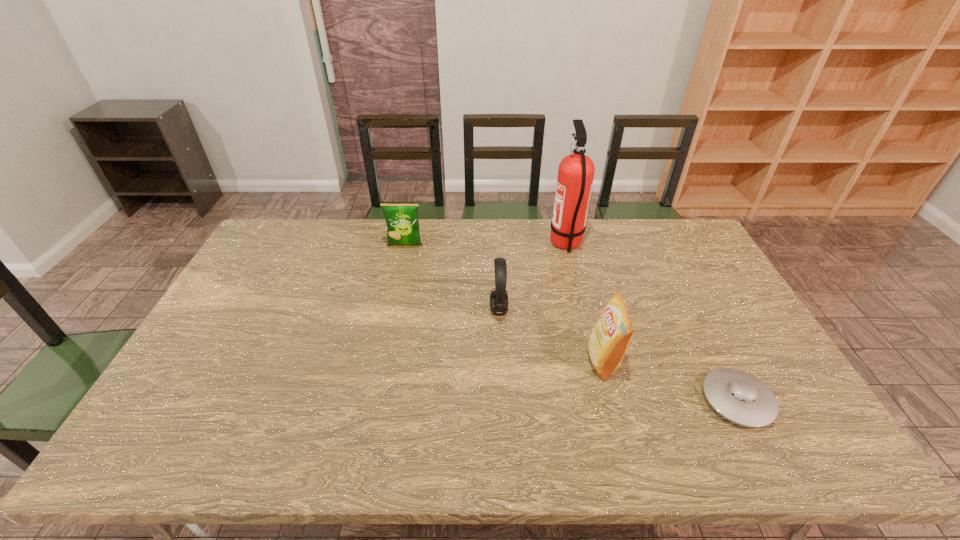
Where is `vacant area that lies between the third nearest object and the left crisp (potato chip)`? The width and height of the screenshot is (960, 540). vacant area that lies between the third nearest object and the left crisp (potato chip) is located at coordinates (452, 278).

At what (x,y) coordinates should I click in order to perform the action: click on vacant space that's between the headset and the right crisp (potato chip). Please return your answer as a coordinate pair (x, y). This screenshot has height=540, width=960. Looking at the image, I should click on (551, 334).

Locate an element on the screen. The image size is (960, 540). vacant space that is in between the tallest object and the nearer crisp (potato chip) is located at coordinates (585, 302).

This screenshot has height=540, width=960. I want to click on vacant area that lies between the left crisp (potato chip) and the fire extinguisher, so click(x=486, y=245).

Image resolution: width=960 pixels, height=540 pixels. I want to click on vacant area that lies between the nearer crisp (potato chip) and the second object from left to right, so pyautogui.click(x=551, y=334).

Find the location of a particular element. This screenshot has width=960, height=540. free area in between the headset and the fire extinguisher is located at coordinates [533, 276].

Image resolution: width=960 pixels, height=540 pixels. I want to click on free space between the fire extinguisher and the nearer crisp (potato chip), so click(x=585, y=302).

This screenshot has height=540, width=960. Identify the location of free space between the fire extinguisher and the saucer. (652, 322).

Locate which object ranks in proximity to the leftmost object. Please provide its 2D coordinates. Your answer should be formatted as a tuple, i.e. [(x, y)], where the tuple contains the x and y coordinates of a point satisfying the conditions above.

[(498, 298)]

Identify the location of object identified as the second closest to the farther crisp (potato chip). (576, 171).